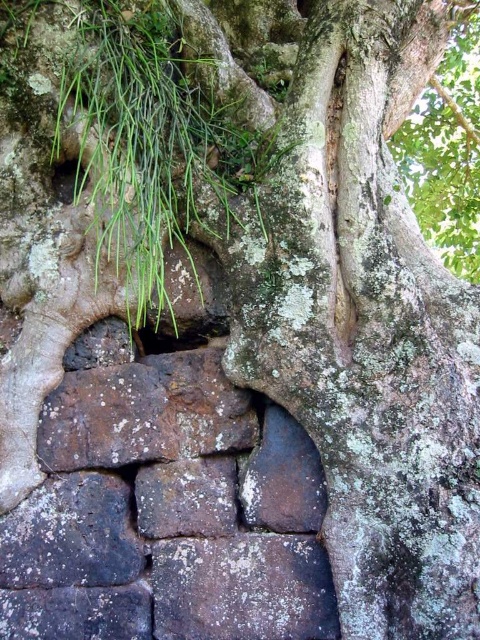
Question: Among these points, which one is nearest to the camera?

Choices:
 (A) (269, 454)
 (B) (169, 484)
 (C) (98, 1)

Answer: (C)

Question: Is gray rough stone at lower left further to camera compared to black stone hole at center?

Choices:
 (A) no
 (B) yes

Answer: (A)

Question: Which point is closer to the camera?

Choices:
 (A) (271, 609)
 (B) (252, 108)
 (C) (266, 465)

Answer: (A)

Question: Which of the following is the farthest from the observer?

Choices:
 (A) (247, 520)
 (B) (156, 268)
 (C) (163, 330)

Answer: (C)

Question: Is gray rough stone at center below black stone hole at center?

Choices:
 (A) no
 (B) yes

Answer: (B)

Question: Can you confirm if green leafy plant at center is positioned below gray rough stone at center?

Choices:
 (A) yes
 (B) no

Answer: (B)